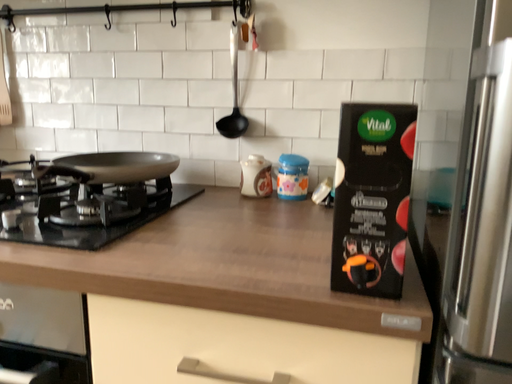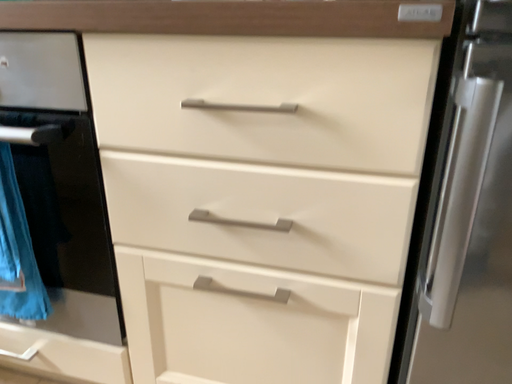
Question: Which way did the camera rotate in the video?

Choices:
 (A) rotated upward
 (B) rotated downward

Answer: (B)